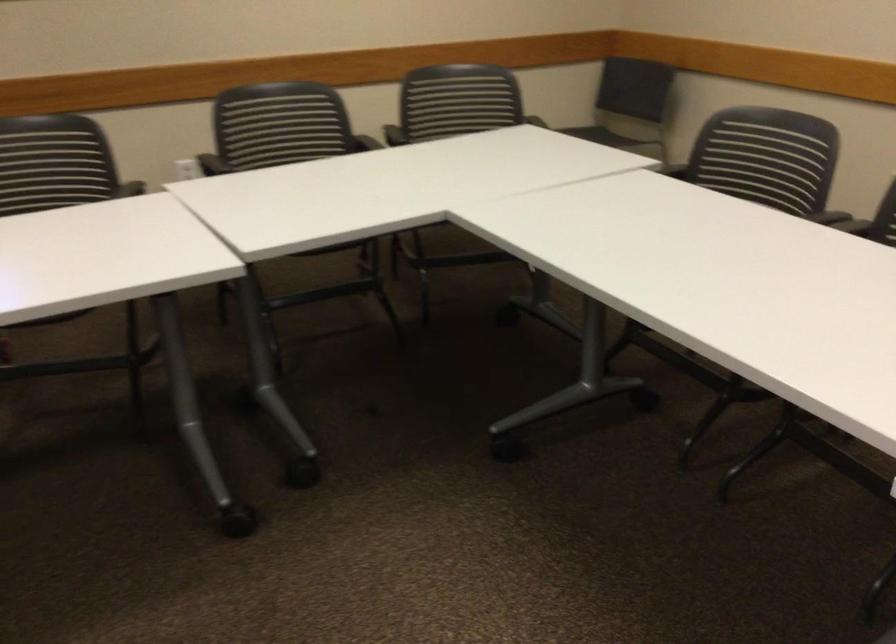
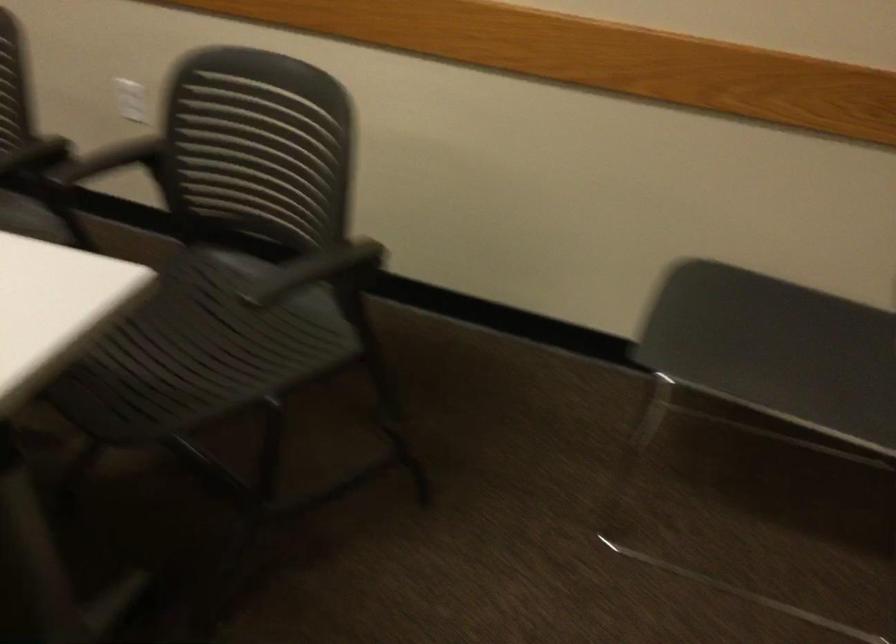
Where in the second image is the point corresponding to pixel 359 146 from the first image?

(35, 156)